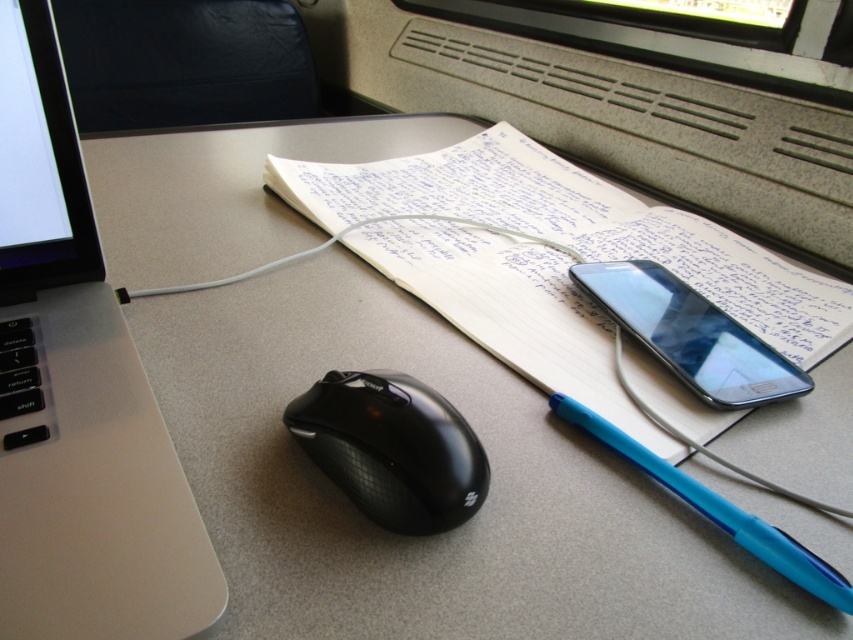
Question: Observing the image, what is the correct spatial positioning of sleek silver laptop at left in reference to blue plastic pen at lower right?

Choices:
 (A) left
 (B) right

Answer: (A)

Question: In this image, where is white paper at center located relative to shiny black phone at center right?

Choices:
 (A) left
 (B) right

Answer: (A)

Question: Does shiny black phone at center right have a smaller size compared to blue plastic pen at lower right?

Choices:
 (A) no
 (B) yes

Answer: (A)

Question: Which point is closer to the camera?

Choices:
 (A) (740, 305)
 (B) (12, 404)
 (C) (550, 403)

Answer: (B)

Question: Which of these objects is positioned closest to the black rubberized mouse at center?

Choices:
 (A) white paper at center
 (B) blue plastic pen at lower right
 (C) shiny black phone at center right
 (D) sleek silver laptop at left

Answer: (B)

Question: Which object is positioned closest to the black rubberized mouse at center?

Choices:
 (A) blue plastic pen at lower right
 (B) white paper at center
 (C) sleek silver laptop at left
 (D) shiny black phone at center right

Answer: (A)